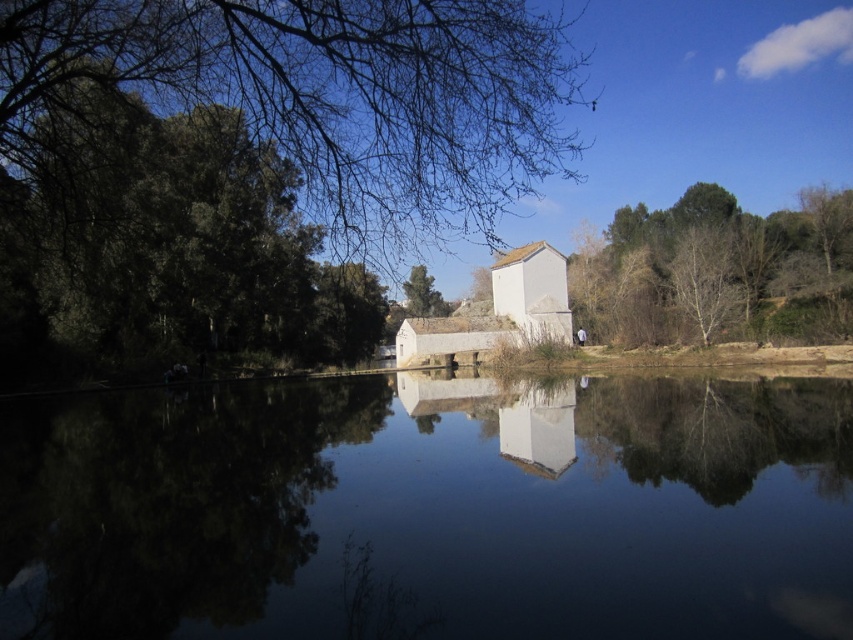
Is point (189, 577) behind point (776, 230)?

No, (189, 577) is in front of (776, 230).

Describe the element at coordinates (431, 509) in the screenshot. The width and height of the screenshot is (853, 640). I see `transparent water at center` at that location.

I want to click on transparent water at center, so click(431, 509).

Does transparent water at center appear over green leafy tree at upper left?

Actually, transparent water at center is below green leafy tree at upper left.

Does point (436, 468) come in front of point (86, 131)?

No, it is not.

At what (x,y) coordinates should I click in order to perform the action: click on transparent water at center. Please return your answer as a coordinate pair (x, y). Looking at the image, I should click on (431, 509).

Which of these two, green leafy tree at upper left or green leafy tree at right, stands taller?

green leafy tree at upper left

Is green leafy tree at upper left thinner than green leafy tree at right?

No.

Where is `green leafy tree at upper left`? green leafy tree at upper left is located at coordinates (300, 102).